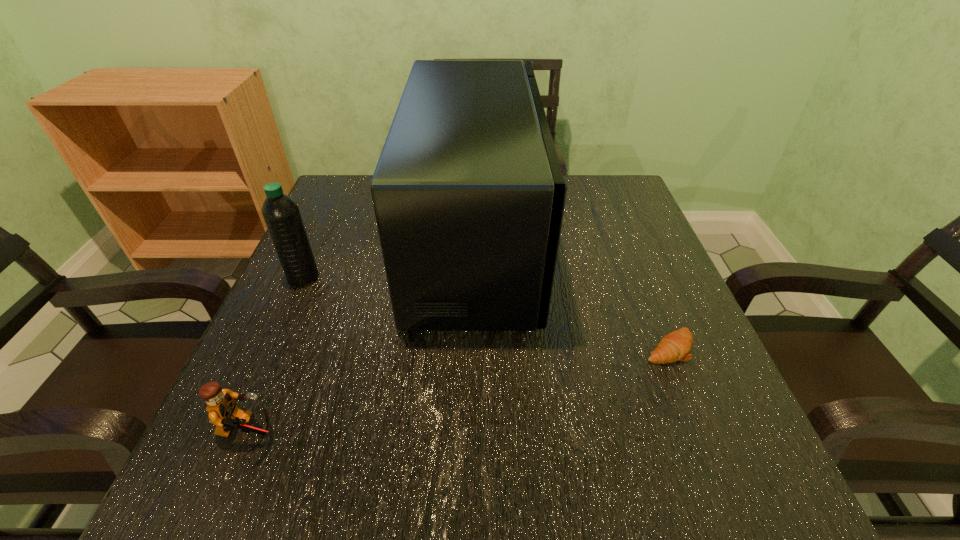
Choose which object is the nearest neighbor to the second object from right to left. Please provide its 2D coordinates. Your answer should be formatted as a tuple, i.e. [(x, y)], where the tuple contains the x and y coordinates of a point satisfying the conditions above.

[(675, 346)]

What are the coordinates of `free spot that satisfies the following two spatial constraints: 1. on the back side of the shortest object; 2. on the front-facing side of the microwave_oven` in the screenshot? It's located at (625, 240).

Find the location of `free location that satisfies the following two spatial constraints: 1. on the front-facing side of the crescent roll; 2. on the right side of the second object from right to left`. free location that satisfies the following two spatial constraints: 1. on the front-facing side of the crescent roll; 2. on the right side of the second object from right to left is located at coordinates (474, 348).

Where is `vacant position in the image that satisfies the following two spatial constraints: 1. on the back side of the shortest object; 2. on the front-facing side of the microwave_oven`? vacant position in the image that satisfies the following two spatial constraints: 1. on the back side of the shortest object; 2. on the front-facing side of the microwave_oven is located at coordinates (625, 240).

Find the location of a particular element. free spot that satisfies the following two spatial constraints: 1. on the front-facing side of the third object from left to right; 2. on the right side of the shortest object is located at coordinates [474, 348].